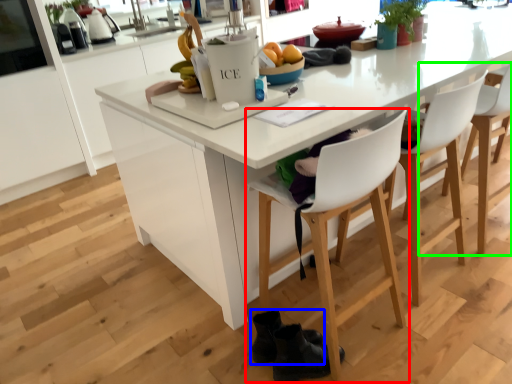
Question: Based on their relative distances, which object is farther from chair (highlighted by a red box)? Choose from footwear (highlighted by a blue box) and chair (highlighted by a green box).

Choices:
 (A) footwear
 (B) chair

Answer: (B)